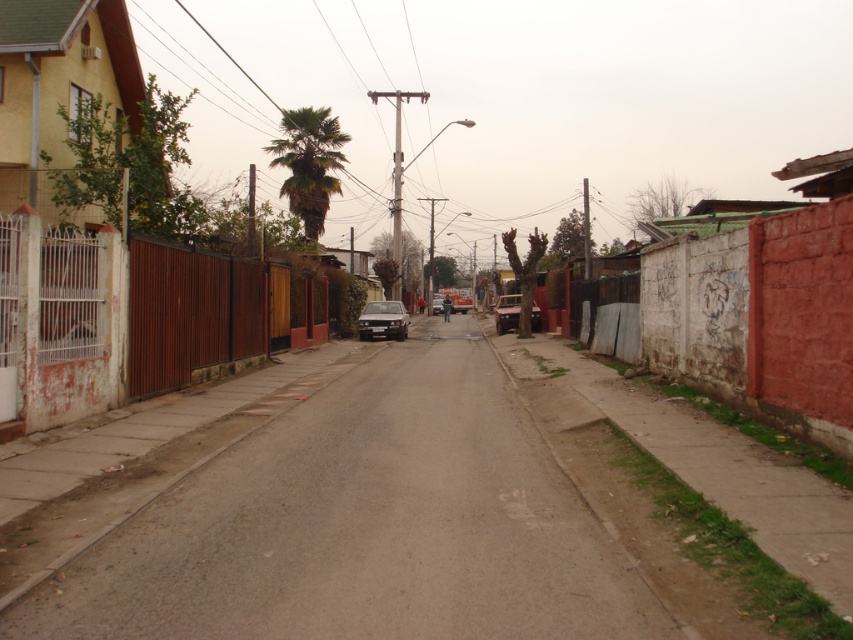
You are a delivery driver who needs to park your satin black car at center without blocking the green leafy palm at center. Is this possible given their sizes?

The green leafy palm at center is taller than the satin black car at center, so parking the satin black car at center without blocking the palm is possible since the palm is taller and may not obstruct the car.